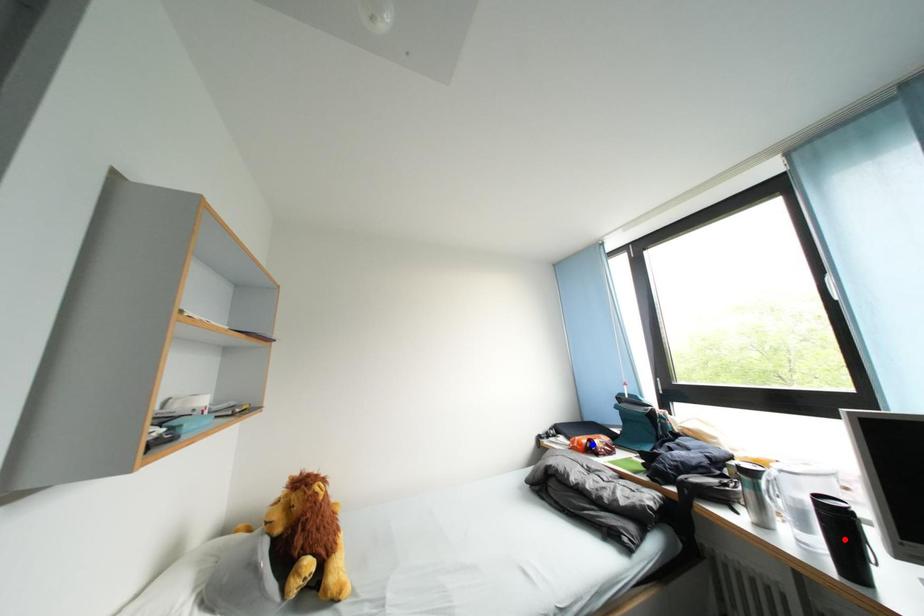
Question: Which of the two points in the image is closer to the camera?

Choices:
 (A) Blue point is closer.
 (B) Red point is closer.

Answer: (B)